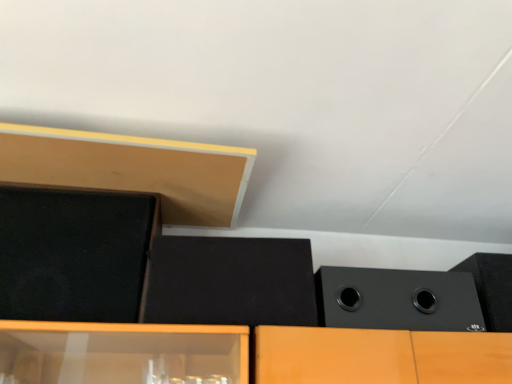
Question: From a real-world perspective, is black matte speaker at right, arranged as the second speaker when viewed from the right, positioned above or below matte black speaker at upper left, which is counted as the fourth speaker, starting from the right?

Choices:
 (A) above
 (B) below

Answer: (B)

Question: Based on their sizes in the image, would you say black matte speaker at right, arranged as the second speaker when viewed from the right, is bigger or smaller than matte black speaker at upper left, which is counted as the fourth speaker, starting from the right?

Choices:
 (A) small
 (B) big

Answer: (B)

Question: Which object is the closest to the matte wood at upper left?

Choices:
 (A) black matte speaker at center, which appears as the third speaker when viewed from the right
 (B) black matte speaker at right, which is the 3th speaker in left-to-right order
 (C) matte black speaker at upper left, which is counted as the fourth speaker, starting from the right
 (D) black matte speaker at upper right, which is counted as the fourth speaker, starting from the left

Answer: (C)

Question: Which object is positioned farthest from the matte black speaker at upper left, which is counted as the fourth speaker, starting from the right?

Choices:
 (A) black matte speaker at center, which appears as the third speaker when viewed from the right
 (B) black matte speaker at right, arranged as the second speaker when viewed from the right
 (C) matte wood at upper left
 (D) black matte speaker at upper right, which is counted as the fourth speaker, starting from the left

Answer: (D)